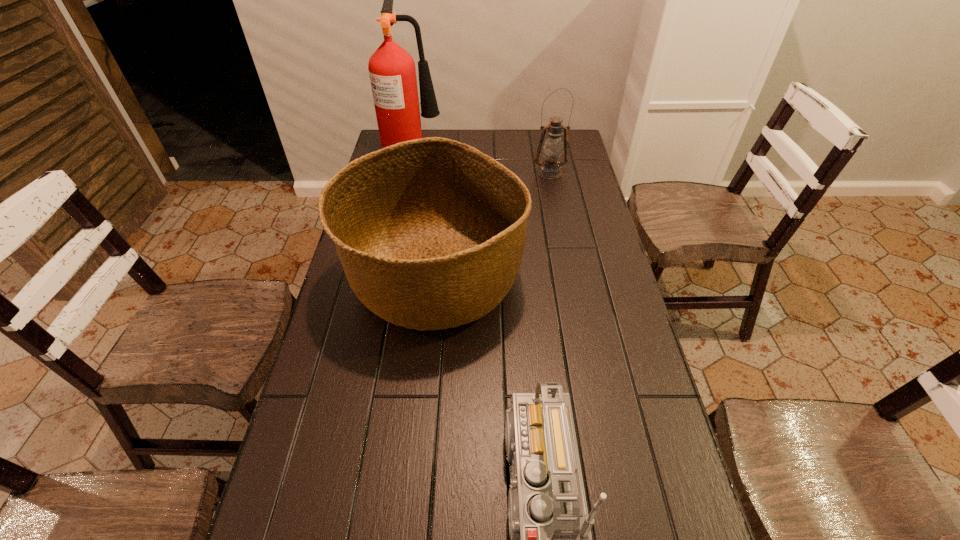
The width and height of the screenshot is (960, 540). I want to click on basket at the left edge, so click(430, 232).

Identify the location of object situated at the right edge. This screenshot has width=960, height=540. (552, 149).

You are a GUI agent. You are given a task and a screenshot of the screen. Output one action in this format:
    pyautogui.click(x=<x>, y=<y>)
    Task: Click on the object situated at the far left corner
    This screenshot has height=540, width=960.
    Given the screenshot: What is the action you would take?
    pyautogui.click(x=392, y=72)

The width and height of the screenshot is (960, 540). In the image, there is a desktop. What are the coordinates of `blank space at the far edge` in the screenshot? It's located at (529, 138).

At what (x,y) coordinates should I click in order to perform the action: click on free region at the left edge of the desktop. Please return your answer as a coordinate pair (x, y). The width and height of the screenshot is (960, 540). Looking at the image, I should click on (339, 472).

The width and height of the screenshot is (960, 540). Find the location of `vacant area at the right edge of the desktop`. vacant area at the right edge of the desktop is located at coordinates (592, 251).

Locate an element on the screen. blank space at the far left corner is located at coordinates (380, 144).

Identify the location of free region at the far right corner of the desktop. This screenshot has width=960, height=540. (563, 155).

Identify the location of object identified as the third closest to the rightmost object. (550, 534).

Where is `object that can be found as the closest to the fire extinguisher`? object that can be found as the closest to the fire extinguisher is located at coordinates (552, 149).